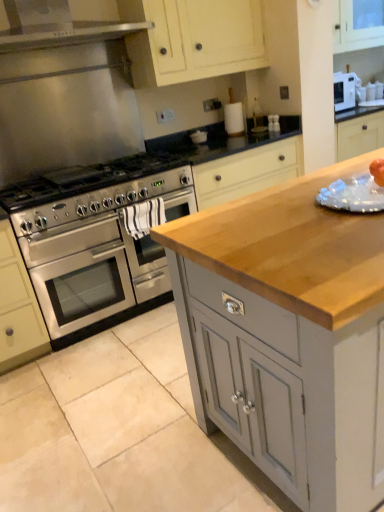
Question: Is matte cream cabinet at upper center, which is the 2th cabinetry in front-to-back order, located outside wooden countertop at center, which is the 2th cabinetry from top to bottom?

Choices:
 (A) yes
 (B) no

Answer: (A)

Question: Does matte cream cabinet at upper center, placed as the first cabinetry when sorted from top to bottom, have a larger size compared to wooden countertop at center, the second cabinetry viewed from the back?

Choices:
 (A) yes
 (B) no

Answer: (B)

Question: Is matte cream cabinet at upper center, which is counted as the 2th cabinetry, starting from the bottom, wider than wooden countertop at center, the 1th cabinetry when ordered from bottom to top?

Choices:
 (A) no
 (B) yes

Answer: (A)

Question: From the image's perspective, is matte cream cabinet at upper center, which is counted as the 2th cabinetry, starting from the bottom, under wooden countertop at center, the 1th cabinetry when ordered from bottom to top?

Choices:
 (A) yes
 (B) no

Answer: (B)

Question: Is matte cream cabinet at upper center, which is the first cabinetry from back to front, closer to camera compared to wooden countertop at center, which is the first cabinetry in front-to-back order?

Choices:
 (A) yes
 (B) no

Answer: (B)

Question: From a real-world perspective, is matte cream cabinet at upper center, which is the first cabinetry from back to front, physically below wooden countertop at center, the second cabinetry viewed from the back?

Choices:
 (A) no
 (B) yes

Answer: (A)

Question: Is matte cream cabinet at upper center, placed as the first cabinetry when sorted from top to bottom, bigger than stainless steel oven at left?

Choices:
 (A) yes
 (B) no

Answer: (B)

Question: From a real-world perspective, is matte cream cabinet at upper center, which is the 2th cabinetry in front-to-back order, located beneath stainless steel oven at left?

Choices:
 (A) no
 (B) yes

Answer: (A)

Question: Does matte cream cabinet at upper center, placed as the first cabinetry when sorted from top to bottom, have a greater height compared to stainless steel oven at left?

Choices:
 (A) no
 (B) yes

Answer: (A)

Question: Is matte cream cabinet at upper center, which is the first cabinetry from back to front, not near stainless steel oven at left?

Choices:
 (A) no
 (B) yes

Answer: (B)

Question: Is matte cream cabinet at upper center, placed as the first cabinetry when sorted from top to bottom, outside stainless steel oven at left?

Choices:
 (A) yes
 (B) no

Answer: (A)

Question: Is matte cream cabinet at upper center, which is counted as the 2th cabinetry, starting from the bottom, aimed at stainless steel oven at left?

Choices:
 (A) no
 (B) yes

Answer: (A)

Question: From a real-world perspective, is wooden countertop at center, which is the first cabinetry in front-to-back order, over matte cream cabinet at upper center, which is the first cabinetry from back to front?

Choices:
 (A) yes
 (B) no

Answer: (B)